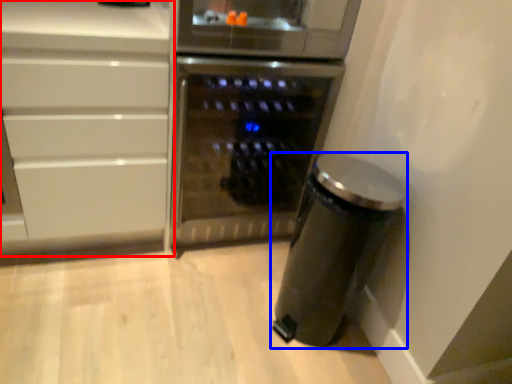
Question: Which of the following is the closest to the observer, cabinetry (highlighted by a red box) or kitchen appliance (highlighted by a blue box)?

Choices:
 (A) cabinetry
 (B) kitchen appliance

Answer: (A)